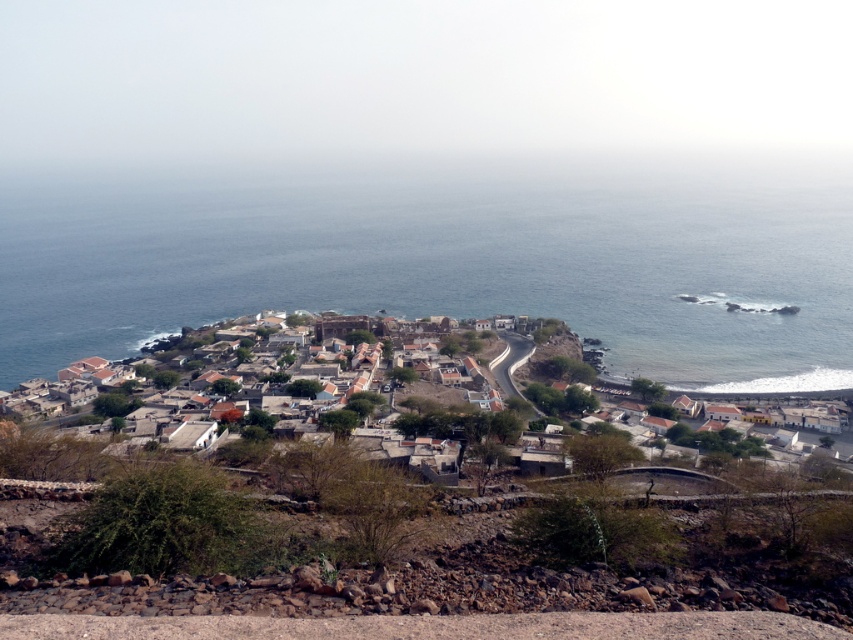
You are a tourist standing at the edge of the winding road in the coastal village. You see the blue water at center and the brown clay houses at center. Which one appears taller from your viewpoint?

The blue water at center appears taller than the brown clay houses at center from your viewpoint.

You are a tourist standing at the edge of the winding road in the coastal village. You see the blue water at center and the brown clay houses at center. Which one is located higher in the image?

The blue water at center is positioned over brown clay houses at center, so the blue water at center is higher in the image.